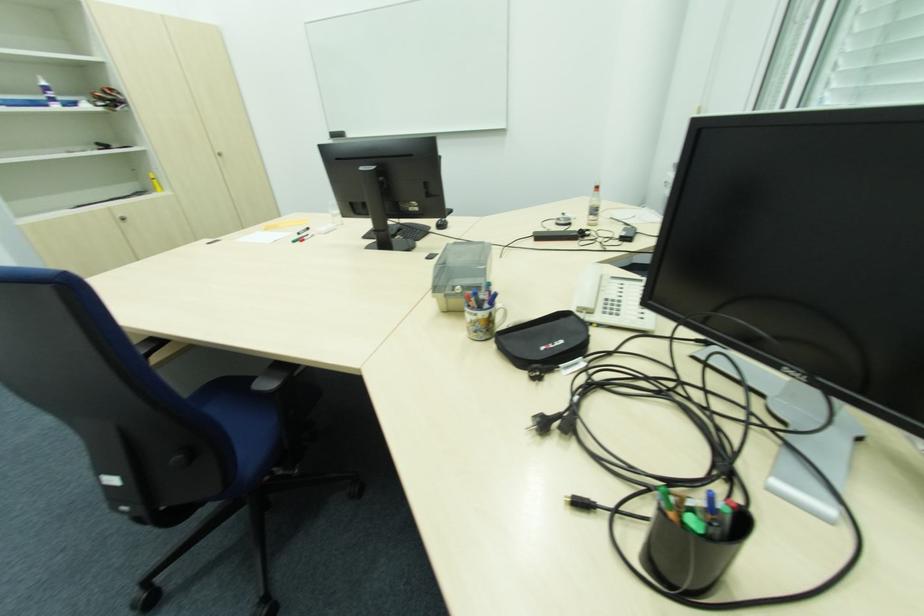
The width and height of the screenshot is (924, 616). Describe the element at coordinates (457, 280) in the screenshot. I see `the plastic box lid` at that location.